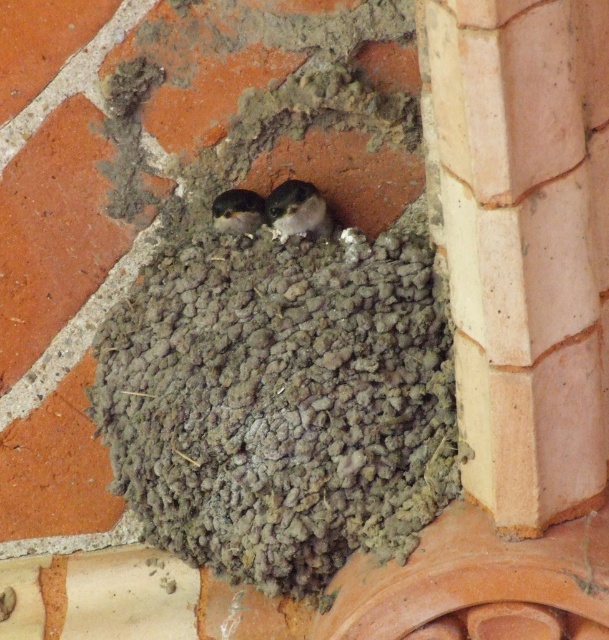
You are a birdwatcher observing a nest on a brick wall. You notice two birds in the nest. One is a white fluffy bird at center and the other is a dark gray feathers at center. Which bird is positioned closer to you?

The white fluffy bird at center is closer to the viewer than dark gray feathers at center.

In the scene shown: You are a birdwatcher observing the nest. You notice the white fluffy bird at center and the pink clay pillar at upper right. Which object is positioned more to the east if the image is oriented with the brick wall facing north?

The pink clay pillar at upper right is positioned to the right of the white fluffy bird at center. Since the wall faces north, the right side of the image corresponds to the east direction. Therefore, the pink clay pillar at upper right is more to the east.